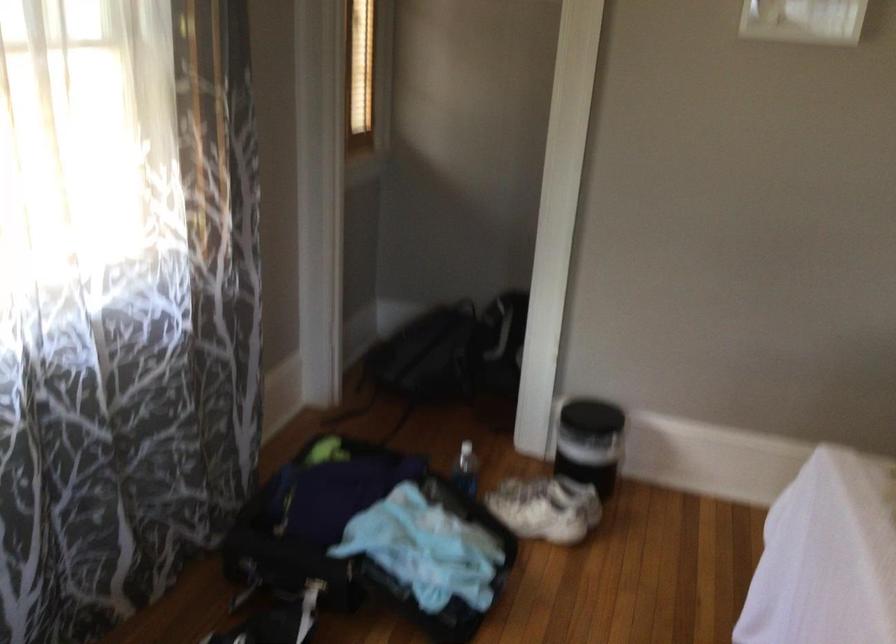
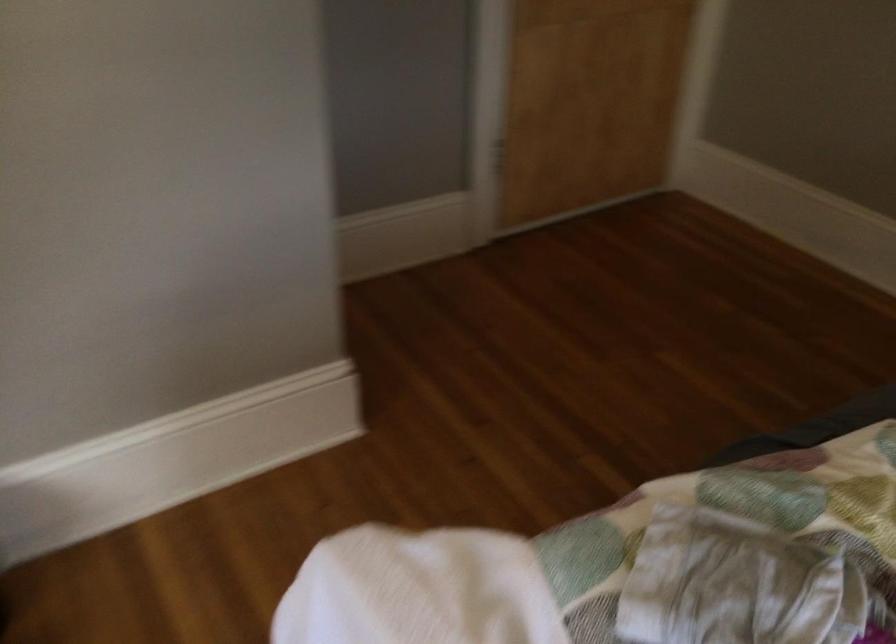
In the scene shown: First-person continuous shooting, in which direction is the camera rotating?

The camera's rotation is toward right-down.